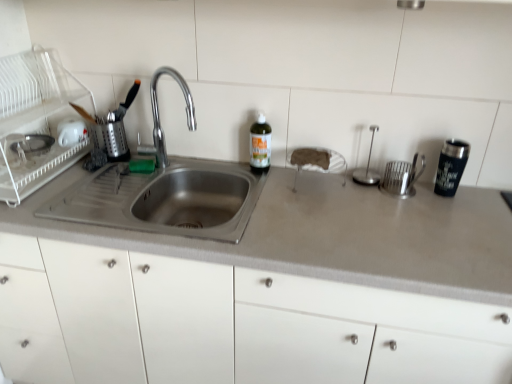
Locate an element on the screen. The height and width of the screenshot is (384, 512). unoccupied area in front of black stainless steel tumbler at right is located at coordinates (462, 218).